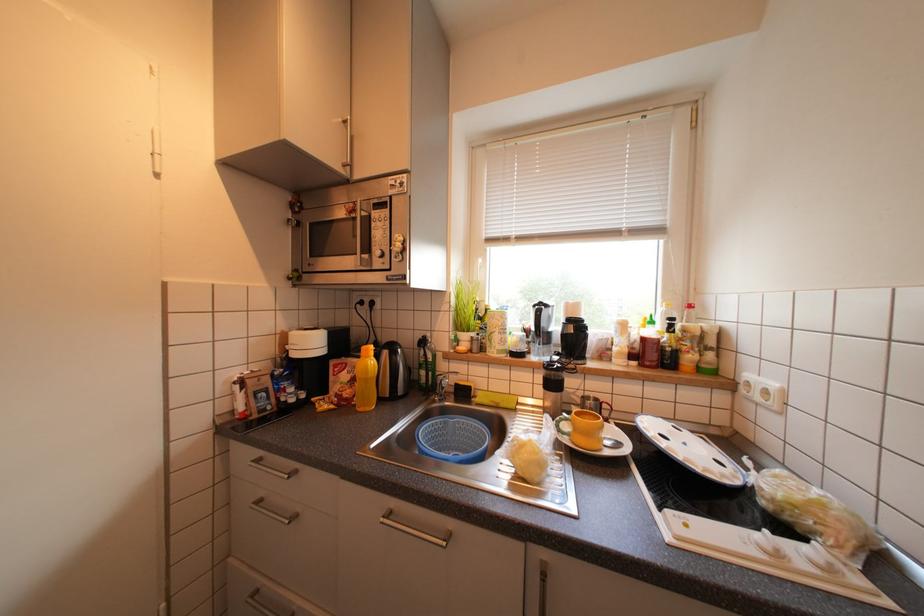
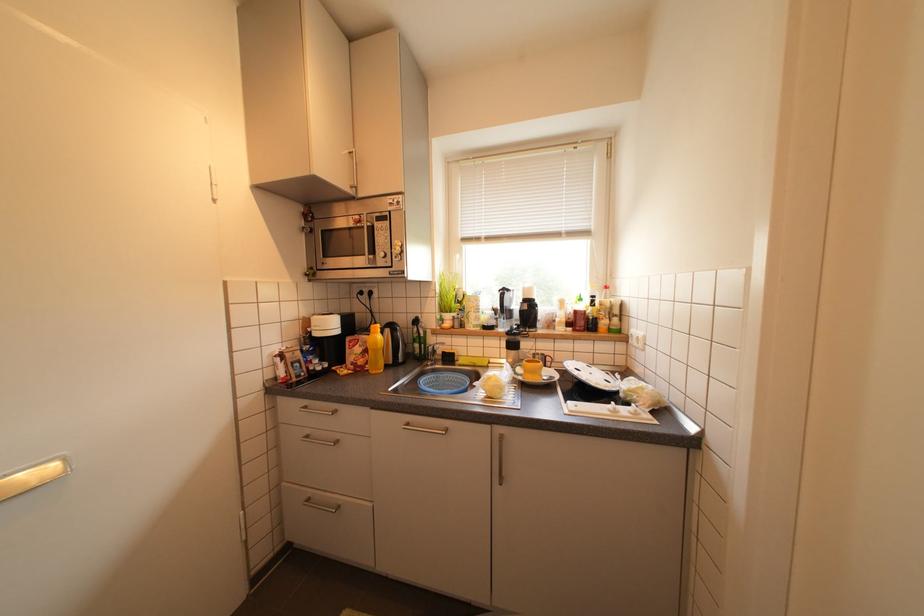
Question: The camera is either moving clockwise (left) or counter-clockwise (right) around the object. The first image is from the beginning of the video and the second image is from the end. Is the camera moving left or right when shooting the video?

Choices:
 (A) Left
 (B) Right

Answer: (A)